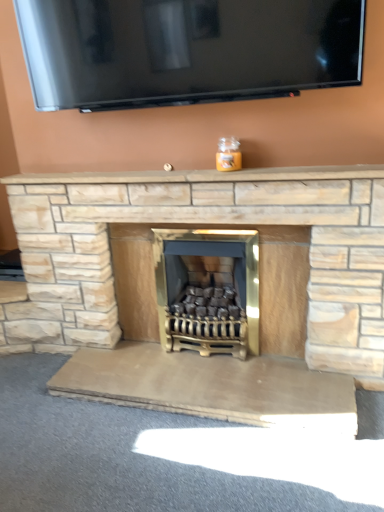
This screenshot has height=512, width=384. I want to click on empty space that is ontop of beige stone mantle at center, so click(202, 173).